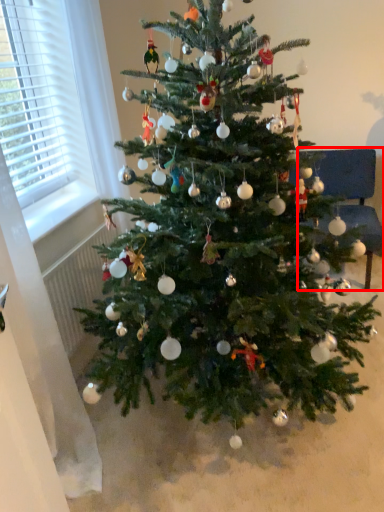
Question: Where is armchair (annotated by the red box) located in relation to christmas tree in the image?

Choices:
 (A) left
 (B) right

Answer: (B)